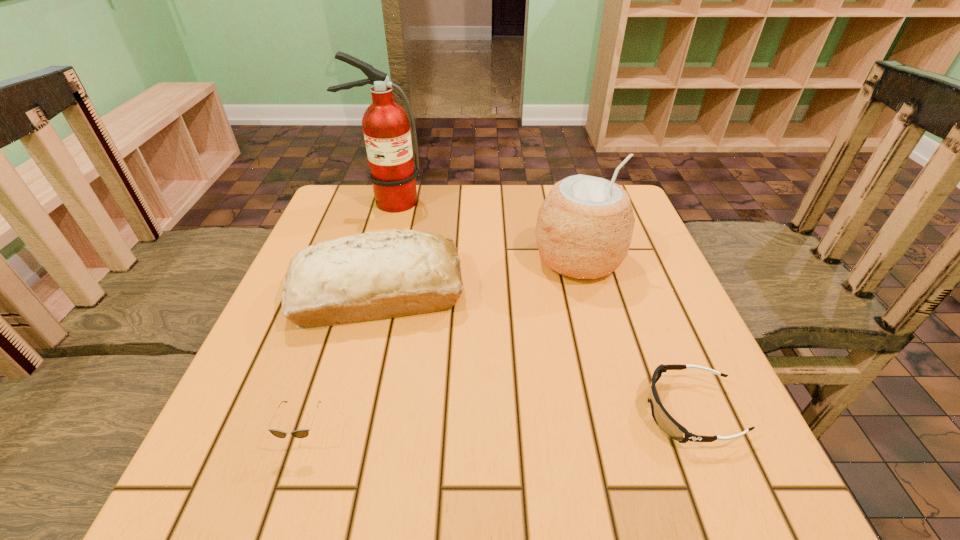
Find the location of a particular element. the closest object to the goggles is located at coordinates (584, 228).

I want to click on free space that satisfies the following two spatial constraints: 1. on the nozzle and handle of the fire extinguisher; 2. on the left side of the coconut, so click(370, 259).

Identify the location of vacant region that satisfies the following two spatial constraints: 1. on the front and sides of the goggles; 2. in front of the lenses of the fourth tallest object. (700, 434).

This screenshot has width=960, height=540. What are the coordinates of `free spot that satisfies the following two spatial constraints: 1. on the nozzle and handle of the coconut; 2. on the left side of the fire extinguisher` in the screenshot? It's located at (370, 259).

Find the location of a particular element. Image resolution: width=960 pixels, height=540 pixels. free space that satisfies the following two spatial constraints: 1. on the front and sides of the shortest object; 2. in front of the lenses of the second shortest object is located at coordinates (700, 434).

Locate an element on the screen. vacant space that satisfies the following two spatial constraints: 1. on the back side of the coconut; 2. on the right side of the bread is located at coordinates (387, 259).